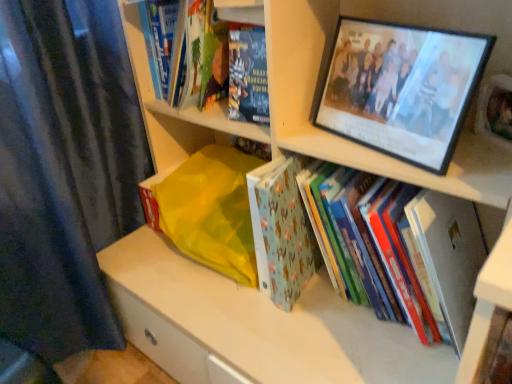
Question: Is point (445, 307) closer or farther from the camera than point (266, 112)?

Choices:
 (A) closer
 (B) farther

Answer: (A)

Question: Is hardcover book at center, marked as the 5th book in a left-to-right arrangement, inside the boundaries of hardcover book at upper center, positioned as the third book in left-to-right order, or outside?

Choices:
 (A) inside
 (B) outside

Answer: (B)

Question: Which object is positioned farthest from the hardcover book at upper left, placed as the second book when sorted from left to right?

Choices:
 (A) hardcover book at lower right
 (B) hardcover book at upper left, positioned as the fifth book in right-to-left order
 (C) wooden photo frame at upper right
 (D) hardcover book at center, the 1th book from the right
 (E) light blue fabric book at center, positioned as the 2th book in right-to-left order

Answer: (A)

Question: Estimate the real-world distances between objects in this image. Which object is farther from the hardcover book at upper left, which ranks as the first book in left-to-right order?

Choices:
 (A) hardcover book at upper left, the fourth book viewed from the right
 (B) hardcover book at center, the 1th book from the right
 (C) hardcover book at lower right
 (D) light blue fabric book at center, positioned as the 2th book in right-to-left order
 (E) hardcover book at upper center, positioned as the third book in left-to-right order

Answer: (C)